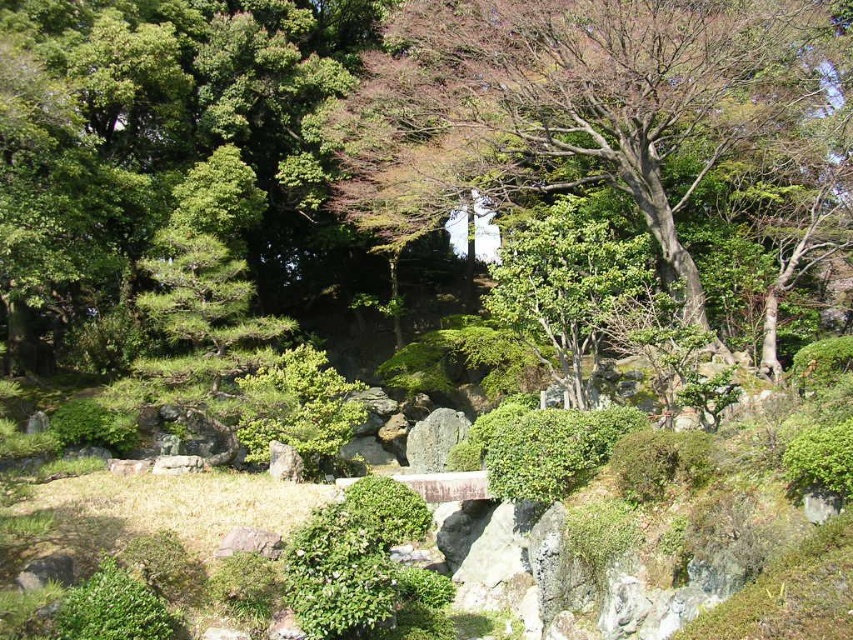
You are standing at the entrance of the garden and notice a point marked at coordinates (601, 116). What object in the garden corresponds to this point?

The point at coordinates (601, 116) corresponds to the green leafy tree at upper center.

You are a gardener who needs to place a 10 feet wide decorative stone path between the green leafy tree at upper center and the wooden bridge. Is there enough space between them to place the path?

The distance between the green leafy tree at upper center and the wooden bridge is 40.02 feet. Since the path is only 10 feet wide, there is sufficient space to place it between them.

You are standing at the camera position in the garden. There is a point marked at coordinates point (479,80). Can you reach that point without moving more than 20 meters?

The point (479,80) is 22.42 meters away from the camera, so you cannot reach it without moving more than 20 meters.